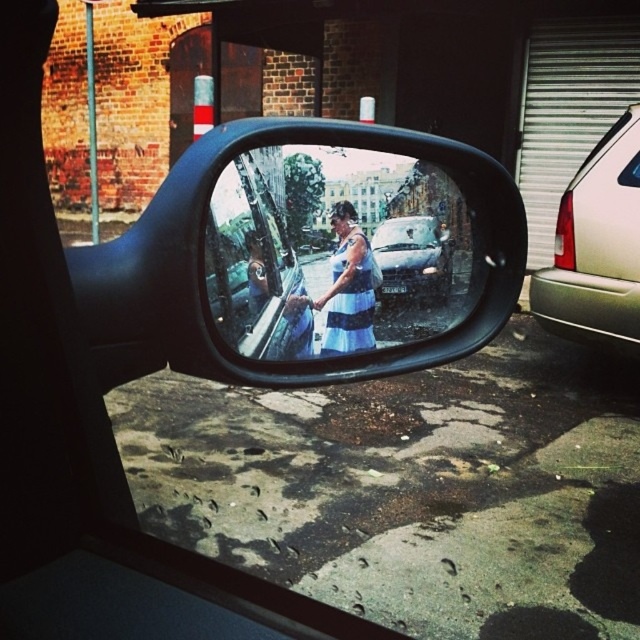
You are a passenger in the car and looking at the side mirror. You notice the blue striped dress at center and the metallic silver car at center in the reflection. Which object appears taller in the mirror?

The blue striped dress at center appears taller than the metallic silver car at center in the mirror.

You are a delivery person standing next to the metallic silver car at right and the metallic silver car at center. You need to place a large box on top of one of these cars. Which car would allow the box to be placed higher off the ground?

The metallic silver car at right has a greater height compared to metallic silver car at center, so placing the large box on top of the metallic silver car at right would allow it to be placed higher off the ground.

You are a delivery person trying to determine if the metallic silver car at right can fit into a parking spot that is exactly the width of the striped fabric dress at center. Based on the scene, can the car fit?

The metallic silver car at right is wider than the striped fabric dress at center, so the car cannot fit into a parking spot that is exactly the width of the striped fabric dress at center.